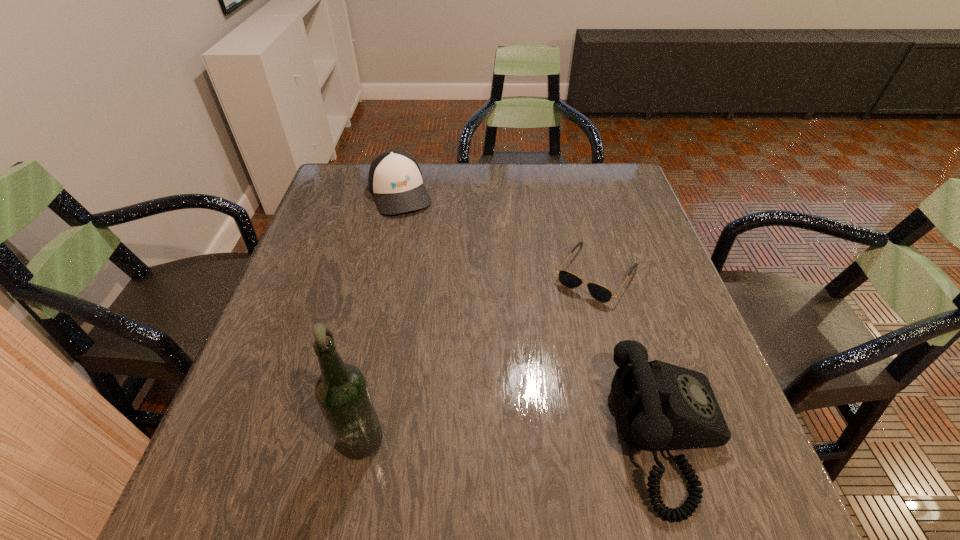
In the image, there is a desktop. Where is `vacant space at the far edge`? The width and height of the screenshot is (960, 540). vacant space at the far edge is located at coordinates [463, 163].

The width and height of the screenshot is (960, 540). I want to click on vacant area at the left edge, so click(x=320, y=309).

Where is `vacant space at the right edge of the desktop`? vacant space at the right edge of the desktop is located at coordinates (665, 330).

Find the location of a particular element. The width and height of the screenshot is (960, 540). vacant area at the far left corner of the desktop is located at coordinates (343, 190).

Find the location of `vacant region at the far right corner`. vacant region at the far right corner is located at coordinates coord(598,199).

What are the coordinates of `vacant space in between the cap and the tallest object` in the screenshot? It's located at pos(382,313).

You are a GUI agent. You are given a task and a screenshot of the screen. Output one action in this format:
    pyautogui.click(x=<x>, y=<y>)
    Task: Click on the empty space between the beer bottle and the telephone
    This screenshot has width=960, height=540.
    Given the screenshot: What is the action you would take?
    pyautogui.click(x=516, y=435)

The width and height of the screenshot is (960, 540). Identify the location of unoccupied area between the cap and the telephone. (535, 315).

The image size is (960, 540). I want to click on empty space that is in between the beer bottle and the farthest object, so 382,313.

This screenshot has width=960, height=540. I want to click on blank region between the telephone and the tallest object, so click(516, 435).